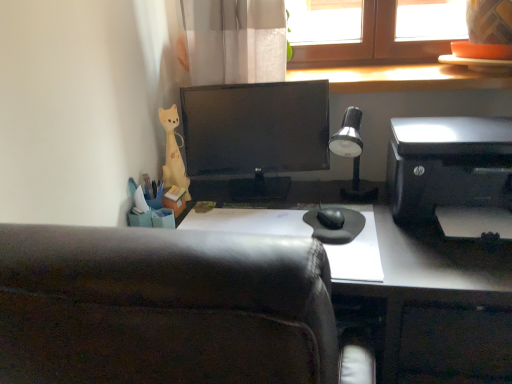
Question: Considering the positions of wooden at upper right and black plastic printer at right in the image, is wooden at upper right taller or shorter than black plastic printer at right?

Choices:
 (A) tall
 (B) short

Answer: (B)

Question: Does point (496, 76) appear closer or farther from the camera than point (439, 198)?

Choices:
 (A) farther
 (B) closer

Answer: (A)

Question: Which of these objects is positioned closest to the black plastic printer at right?

Choices:
 (A) yellow matte figurine at upper left
 (B) leather at center
 (C) wooden at upper right
 (D) silver metallic desk lamp at upper right

Answer: (D)

Question: Which of these objects is positioned farthest from the silver metallic desk lamp at upper right?

Choices:
 (A) black plastic printer at right
 (B) yellow matte figurine at upper left
 (C) wooden at upper right
 (D) leather at center

Answer: (D)